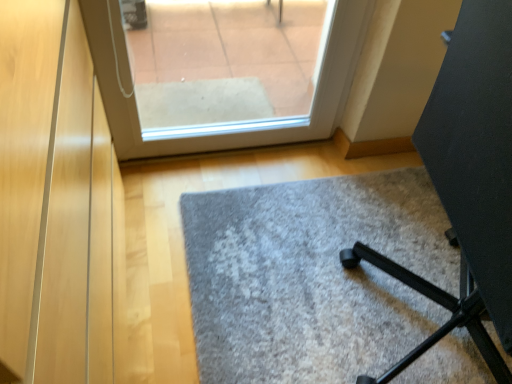
Locate an element on the screen. The image size is (512, 384). black matte tripod at lower right is located at coordinates (468, 182).

This screenshot has height=384, width=512. Describe the element at coordinates (468, 182) in the screenshot. I see `black matte tripod at lower right` at that location.

What is the approximate height of black matte tripod at lower right?

The height of black matte tripod at lower right is 34.59 inches.

Describe the element at coordinates (313, 276) in the screenshot. I see `gray carpet at center` at that location.

Where is `gray carpet at center`? gray carpet at center is located at coordinates (313, 276).

What is the approximate height of gray carpet at center?

gray carpet at center is 4.98 centimeters in height.

The width and height of the screenshot is (512, 384). In order to click on black matte tripod at lower right in this screenshot , I will do point(468,182).

Considering the relative positions of black matte tripod at lower right and gray carpet at center in the image provided, is black matte tripod at lower right to the left or to the right of gray carpet at center?

From the image, it's evident that black matte tripod at lower right is to the right of gray carpet at center.

Which object is further away from the camera taking this photo, black matte tripod at lower right or gray carpet at center?

gray carpet at center is behind.

Which is farther from the camera, (381, 376) or (466, 339)?

The point (466, 339) is behind.

Based on the photo, from the image's perspective, is black matte tripod at lower right under gray carpet at center?

No, from the image's perspective, black matte tripod at lower right is not below gray carpet at center.

From a real-world perspective, is black matte tripod at lower right located higher than gray carpet at center?

Correct, in the physical world, black matte tripod at lower right is higher than gray carpet at center.

Is black matte tripod at lower right thinner than gray carpet at center?

Yes.

Considering the relative sizes of black matte tripod at lower right and gray carpet at center in the image provided, is black matte tripod at lower right shorter than gray carpet at center?

No.

Considering the relative sizes of black matte tripod at lower right and gray carpet at center in the image provided, is black matte tripod at lower right smaller than gray carpet at center?

No, black matte tripod at lower right is not smaller than gray carpet at center.

Consider the image. Would you say gray carpet at center is part of black matte tripod at lower right's contents?

No, gray carpet at center is not a part of black matte tripod at lower right.

Would you say black matte tripod at lower right is a long distance from gray carpet at center?

No.

Is black matte tripod at lower right facing away from gray carpet at center?

No, gray carpet at center is not at the back of black matte tripod at lower right.

How different are the orientations of black matte tripod at lower right and gray carpet at center in degrees?

black matte tripod at lower right and gray carpet at center are facing 90.2 degrees away from each other.

How much distance is there between black matte tripod at lower right and gray carpet at center?

10.54 inches.

Image resolution: width=512 pixels, height=384 pixels. There is a gray carpet at center. What are the coordinates of `furniture above it (from a real-world perspective)` in the screenshot? It's located at (468, 182).

Which object is positioned more to the right, gray carpet at center or black matte tripod at lower right?

From the viewer's perspective, black matte tripod at lower right appears more on the right side.

Who is more distant, gray carpet at center or black matte tripod at lower right?

gray carpet at center is further from the camera.

Considering the positions of points (415, 381) and (465, 168), is point (415, 381) closer to camera compared to point (465, 168)?

No, it is not.

From the image's perspective, is gray carpet at center under black matte tripod at lower right?

Correct, gray carpet at center appears lower than black matte tripod at lower right in the image.

From a real-world perspective, is gray carpet at center below black matte tripod at lower right?

Yes, from a real-world perspective, gray carpet at center is under black matte tripod at lower right.

Can you confirm if gray carpet at center is thinner than black matte tripod at lower right?

No.

Which of these two, gray carpet at center or black matte tripod at lower right, stands shorter?

With less height is gray carpet at center.

Looking at the image, does gray carpet at center seem bigger or smaller compared to black matte tripod at lower right?

Considering their sizes, gray carpet at center takes up less space than black matte tripod at lower right.

Can we say gray carpet at center lies outside black matte tripod at lower right?

Yes, gray carpet at center is not within black matte tripod at lower right.

Is gray carpet at center far away from black matte tripod at lower right?

No, gray carpet at center is not far away from black matte tripod at lower right.

Is gray carpet at center turned away from black matte tripod at lower right?

That's not correct — gray carpet at center is not looking away from black matte tripod at lower right.

You are a GUI agent. You are given a task and a screenshot of the screen. Output one action in this format:
    pyautogui.click(x=<x>, y=<y>)
    Task: Click on the door on the left of the black matte tripod at lower right
    The height and width of the screenshot is (384, 512).
    Given the screenshot: What is the action you would take?
    pyautogui.click(x=313, y=276)

Where is `door below the black matte tripod at lower right (from a real-world perspective)`? Image resolution: width=512 pixels, height=384 pixels. door below the black matte tripod at lower right (from a real-world perspective) is located at coordinates (313, 276).

This screenshot has width=512, height=384. I want to click on furniture that appears above the gray carpet at center (from the image's perspective), so click(x=468, y=182).